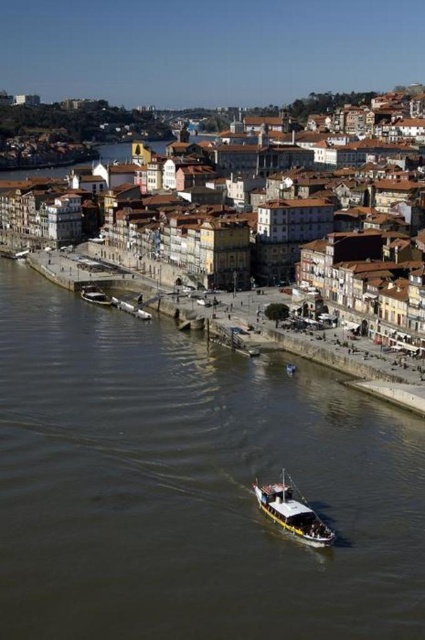
Is brown textured buildings at center to the right of white matte boat at center from the viewer's perspective?

Correct, you'll find brown textured buildings at center to the right of white matte boat at center.

Does brown textured buildings at center have a larger size compared to white matte boat at center?

Correct, brown textured buildings at center is larger in size than white matte boat at center.

Measure the distance between brown textured buildings at center and camera.

brown textured buildings at center is 469.13 feet away from camera.

The height and width of the screenshot is (640, 425). I want to click on brown textured buildings at center, so click(x=300, y=228).

Is brown water at center shorter than white matte boat at center?

No, brown water at center is not shorter than white matte boat at center.

Does brown water at center appear over white matte boat at center?

Yes.

Find the location of a particular element. Image resolution: width=425 pixels, height=640 pixels. brown water at center is located at coordinates (190, 484).

Is brown water at center to the left of brown textured buildings at center from the viewer's perspective?

Indeed, brown water at center is positioned on the left side of brown textured buildings at center.

Can you confirm if brown water at center is taller than brown textured buildings at center?

In fact, brown water at center may be shorter than brown textured buildings at center.

Is point (404, 436) closer to camera compared to point (312, 278)?

Yes.

The height and width of the screenshot is (640, 425). What are the coordinates of `brown water at center` in the screenshot? It's located at (190, 484).